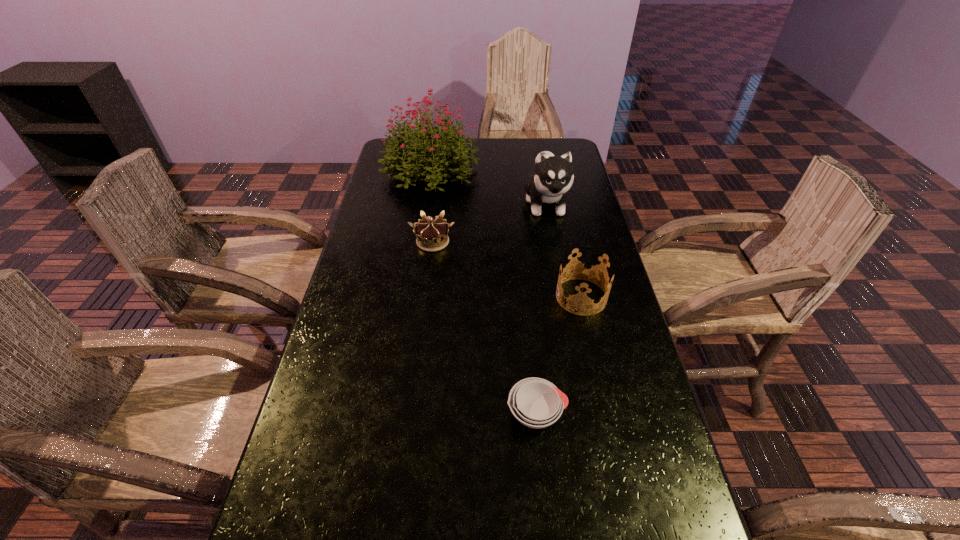
Where is `free space located 0.320m on the front of the taller crown`? The height and width of the screenshot is (540, 960). free space located 0.320m on the front of the taller crown is located at coordinates (612, 430).

Find the location of `vacant point located on the front of the left crown`. vacant point located on the front of the left crown is located at coordinates (420, 345).

What are the coordinates of `vacant space located 0.170m on the front of the soup bowl` in the screenshot? It's located at pyautogui.click(x=547, y=529).

The height and width of the screenshot is (540, 960). I want to click on object present at the far edge, so click(x=411, y=145).

In order to click on object present at the left edge in this screenshot , I will do `click(411, 145)`.

You are a GUI agent. You are given a task and a screenshot of the screen. Output one action in this format:
    pyautogui.click(x=<x>, y=<y>)
    Task: Click on the puppy that is at the right edge
    The height and width of the screenshot is (540, 960).
    Given the screenshot: What is the action you would take?
    pyautogui.click(x=553, y=177)

Image resolution: width=960 pixels, height=540 pixels. In order to click on crown that is at the right edge in this screenshot , I will do `click(579, 298)`.

The height and width of the screenshot is (540, 960). In order to click on object present at the far left corner in this screenshot , I will do `click(411, 145)`.

Locate an element on the screen. Image resolution: width=960 pixels, height=540 pixels. vacant position at the far edge of the desktop is located at coordinates (473, 142).

Find the location of `free space at the left edge`. free space at the left edge is located at coordinates (391, 288).